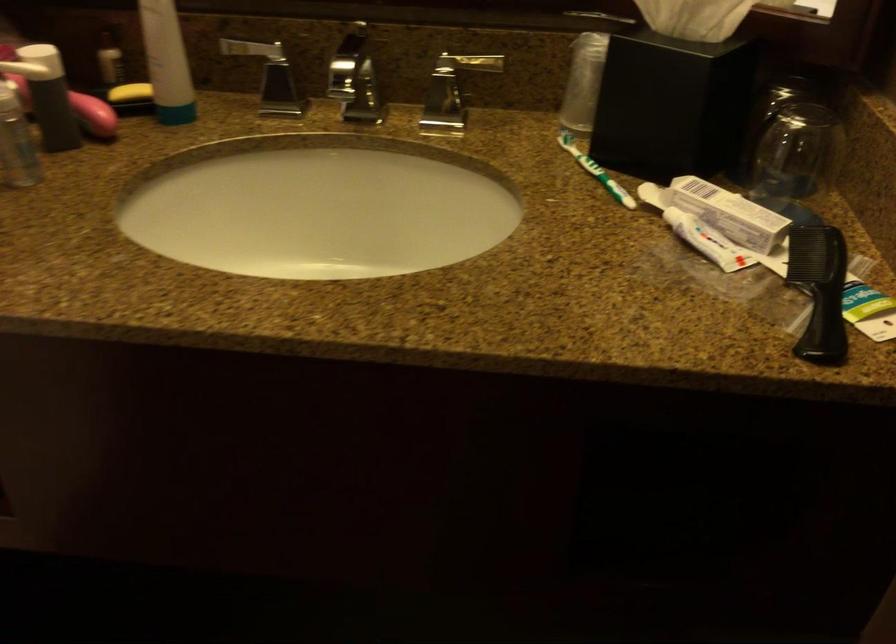
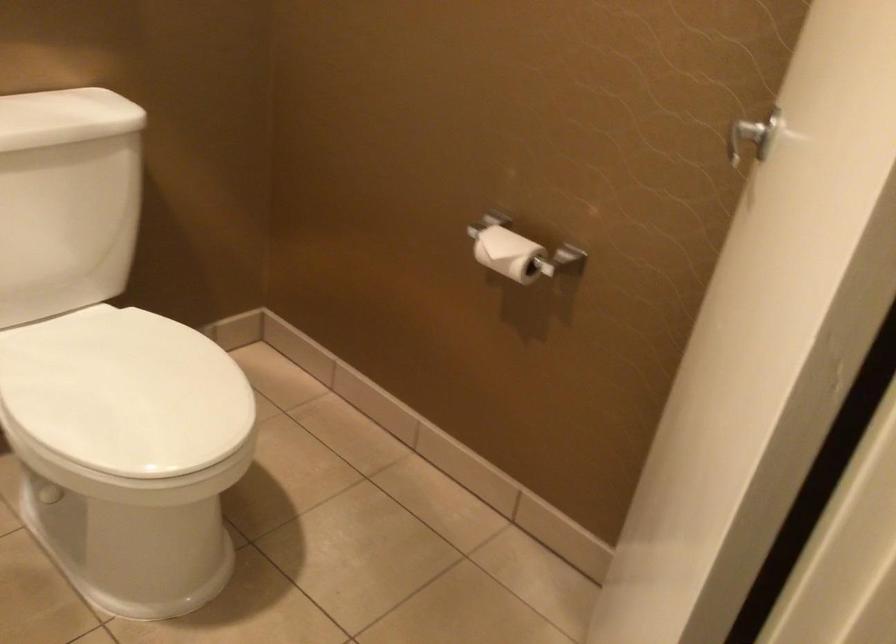
Question: Based on the continuous images, in which direction is the camera rotating? Reply with the corresponding letter.

Choices:
 (A) Left
 (B) Right
 (C) Up
 (D) Down

Answer: (A)